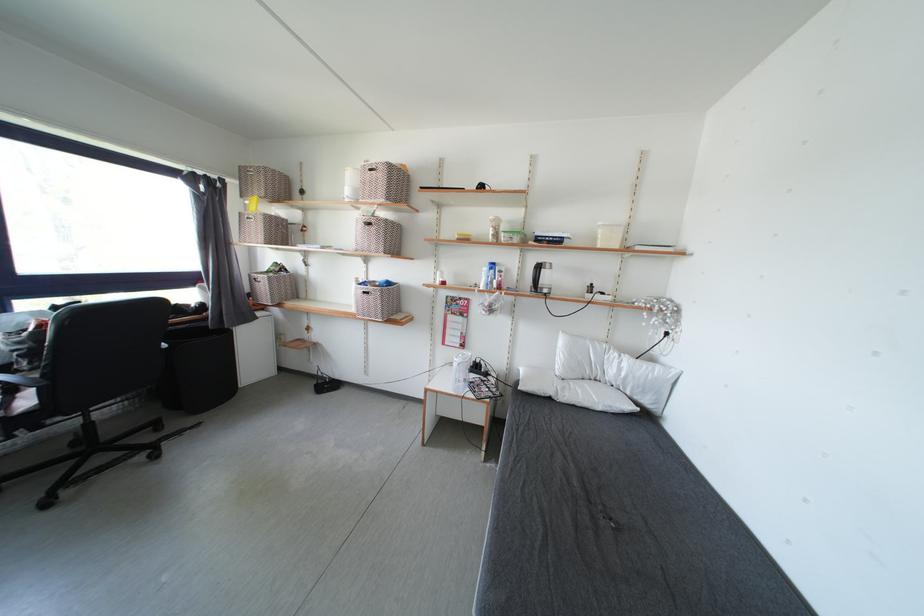
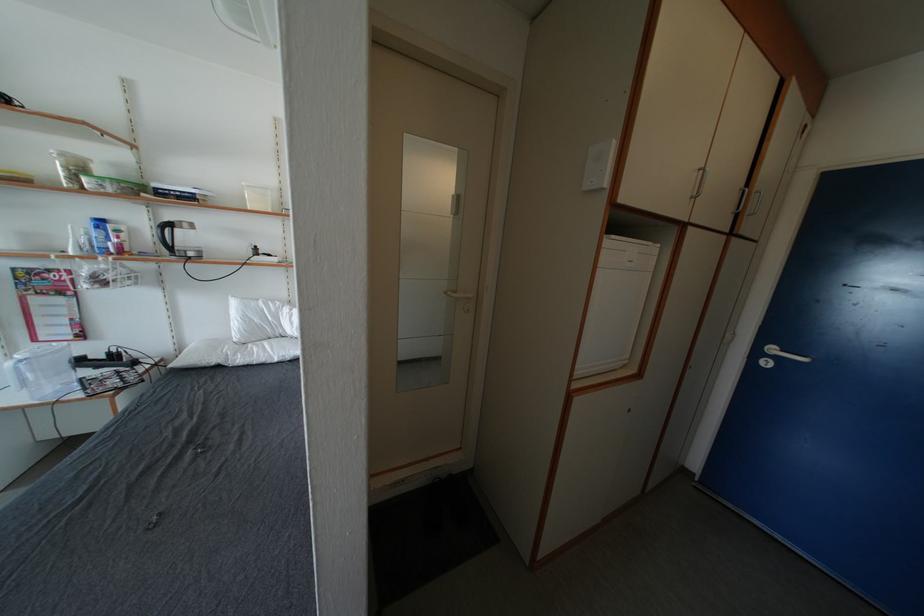
Find the pixel in the second image that matches point (500, 240) in the first image.

(75, 184)